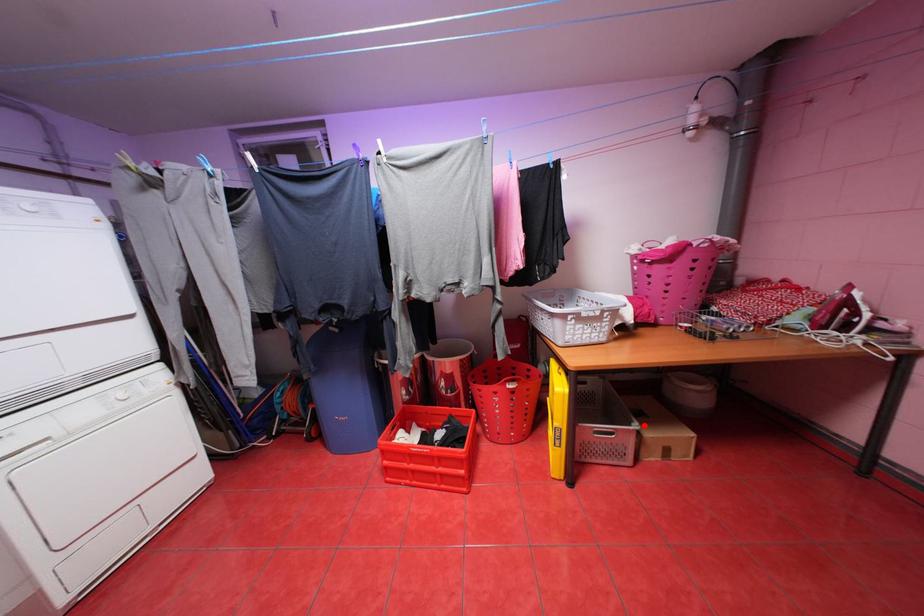
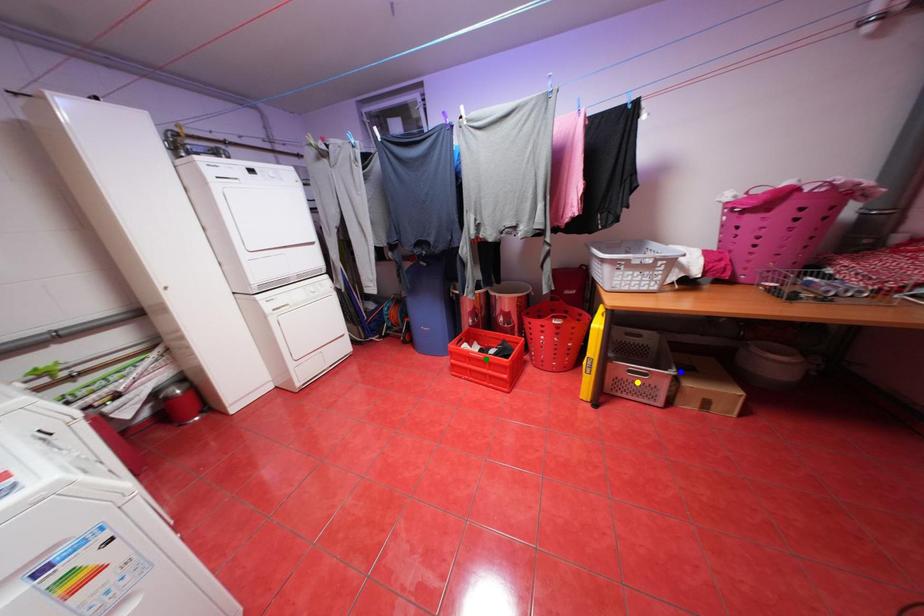
Question: I am providing you with two images of the same scene from different viewpoints. A red point is marked on the first image. You are given multiple points on the second image. Which mark in image 2 goes with the point in image 1?

Choices:
 (A) yellow point
 (B) blue point
 (C) green point

Answer: (B)